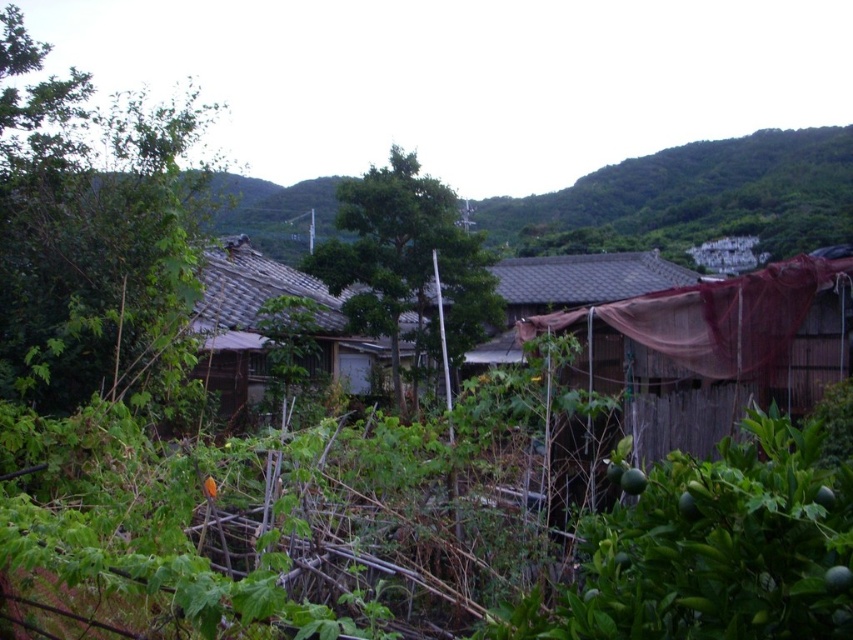
Question: Which object is positioned farthest from the green leafy tree at center?

Choices:
 (A) brown tile roof hut at center
 (B) green leafy tree at left
 (C) brown wooden hut at right

Answer: (B)

Question: Is brown wooden hut at right thinner than green leafy tree at center?

Choices:
 (A) yes
 (B) no

Answer: (A)

Question: Which object is the closest to the brown wooden hut at right?

Choices:
 (A) brown tile roof hut at center
 (B) green leafy tree at left

Answer: (A)

Question: Is the position of brown wooden hut at right more distant than that of brown tile roof hut at center?

Choices:
 (A) no
 (B) yes

Answer: (A)

Question: Can you confirm if green leafy tree at center is wider than brown tile roof hut at center?

Choices:
 (A) yes
 (B) no

Answer: (B)

Question: Which object is the farthest from the green leafy tree at center?

Choices:
 (A) brown wooden hut at right
 (B) green leafy tree at left
 (C) brown tile roof hut at center

Answer: (B)